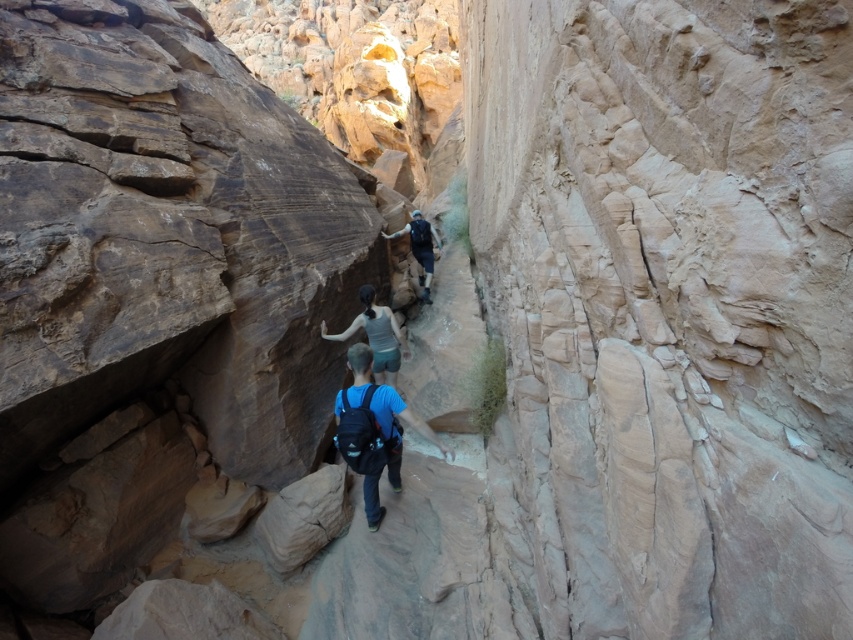
Question: Is smooth beige rock at center wider than matte blue backpack at center?

Choices:
 (A) no
 (B) yes

Answer: (A)

Question: Based on their relative distances, which object is farther from the light blue fabric shirt at center?

Choices:
 (A) matte blue backpack at center
 (B) blue fabric backpack at center
 (C) smooth beige rock at center

Answer: (A)

Question: Is the position of blue fabric backpack at center more distant than that of matte blue backpack at center?

Choices:
 (A) yes
 (B) no

Answer: (B)

Question: Which point appears farthest from the camera in this image?

Choices:
 (A) (432, 268)
 (B) (367, 308)
 (C) (584, 448)
 (D) (422, 429)

Answer: (A)

Question: Which object is closer to the camera taking this photo?

Choices:
 (A) matte blue backpack at center
 (B) light blue fabric shirt at center
 (C) blue fabric backpack at center

Answer: (C)

Question: Does smooth beige rock at center come behind matte blue backpack at center?

Choices:
 (A) yes
 (B) no

Answer: (B)